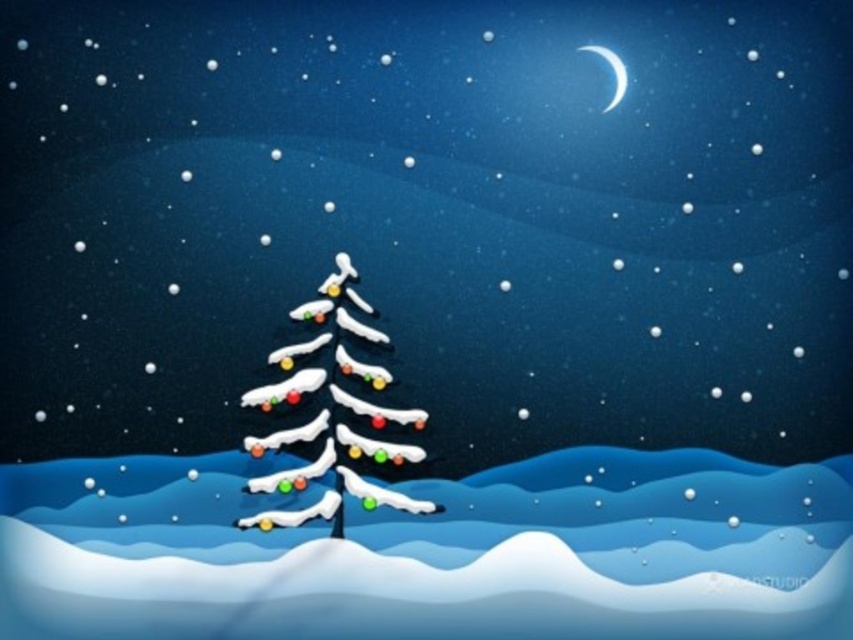
You are an astronomer observing the winter night scene. You notice the icy white christmas tree at center and the white glossy crescent moon at upper right. Which object would appear bigger in the sky when viewed from your telescope? Please explain your reasoning based on their sizes in the image.

The icy white christmas tree at center appears bigger in the image than the white glossy crescent moon at upper right. Since the question asks about their apparent size in the sky as viewed from a telescope, the answer depends on their actual sizes and distances. However, according to the provided description, the icy white christmas tree at center is explicitly stated to be larger in size than the white glossy crescent moon at upper right within the image context. Therefore, when viewed through the telesc